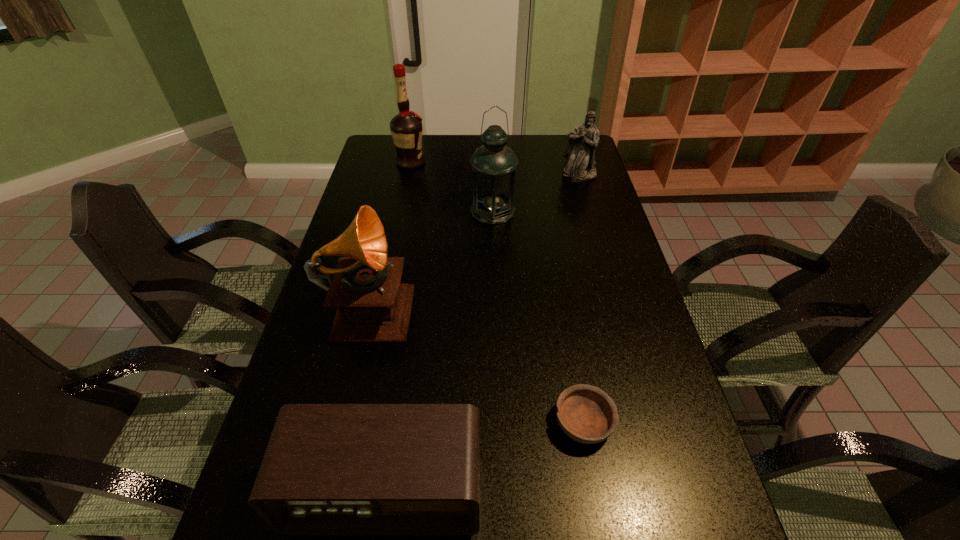
Locate an element on the screen. The width and height of the screenshot is (960, 540). free location that satisfies the following two spatial constraints: 1. on the front and back of the liquor; 2. on the left side of the bowl is located at coordinates (355, 422).

I want to click on free space that satisfies the following two spatial constraints: 1. on the horn of the bowl; 2. on the left side of the phonograph record, so click(341, 422).